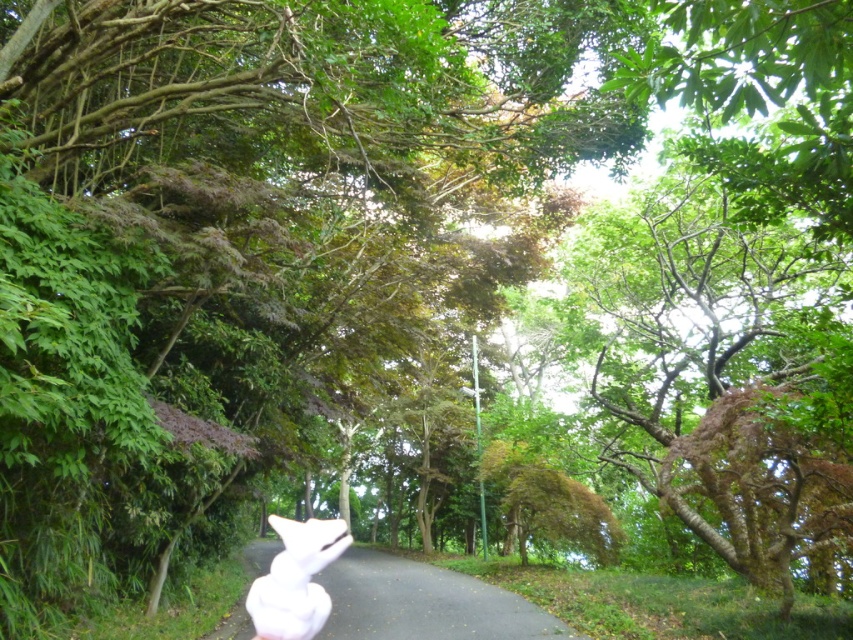
You are standing at the edge of the pathway and see both the white fabric at center and the white fluffy bunny at center. Which object is closer to you?

The white fluffy bunny at center is closer to you because the white fabric at center is 2.23 meters away from it, meaning the bunny is nearer to your position at the pathway edge.

You are a photographer trying to capture both the white fabric at center and the white fluffy bunny at center in the same frame. Based on their sizes, which object should you focus on first to ensure both fit in the photo?

The white fabric at center is wider than the white fluffy bunny at center, so you should focus on the white fabric at center first to ensure both fit in the photo.